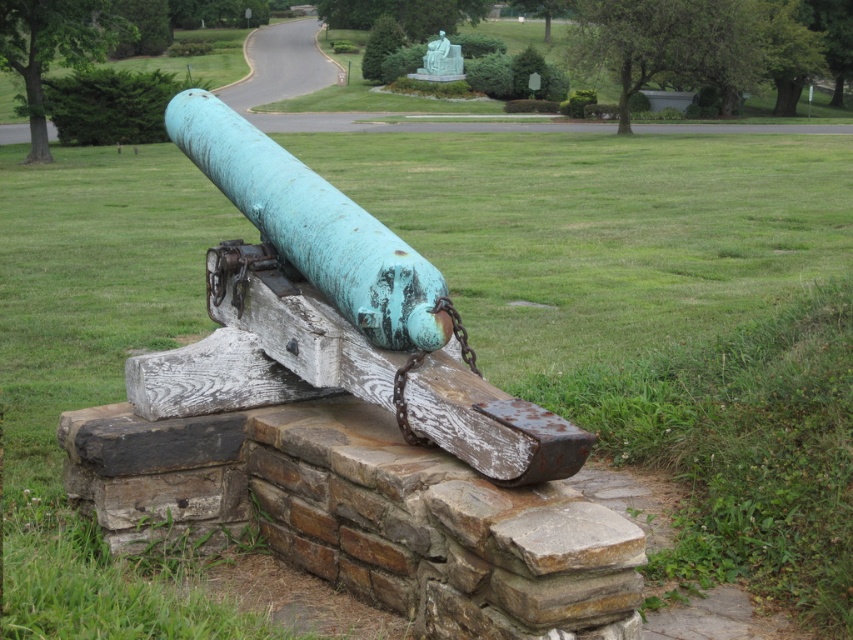
Question: Which point is closer to the camera?

Choices:
 (A) green patina metal cannon at center
 (B) rusty wood log at center

Answer: (A)

Question: Observing the image, what is the correct spatial positioning of green patina metal cannon at center in reference to rusty wood log at center?

Choices:
 (A) right
 (B) left

Answer: (A)

Question: Does green patina metal cannon at center have a larger size compared to rusty wood log at center?

Choices:
 (A) yes
 (B) no

Answer: (A)

Question: Which point appears closest to the camera in this image?

Choices:
 (A) (233, 144)
 (B) (422, 298)

Answer: (B)

Question: Can you confirm if green patina metal cannon at center is bigger than rusty wood log at center?

Choices:
 (A) no
 (B) yes

Answer: (B)